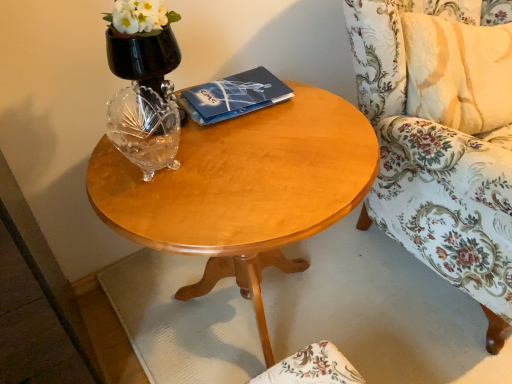
Locate an element on the screen. This screenshot has width=512, height=384. free point above light wood/finish coffee table at center (from a real-world perspective) is located at coordinates (262, 145).